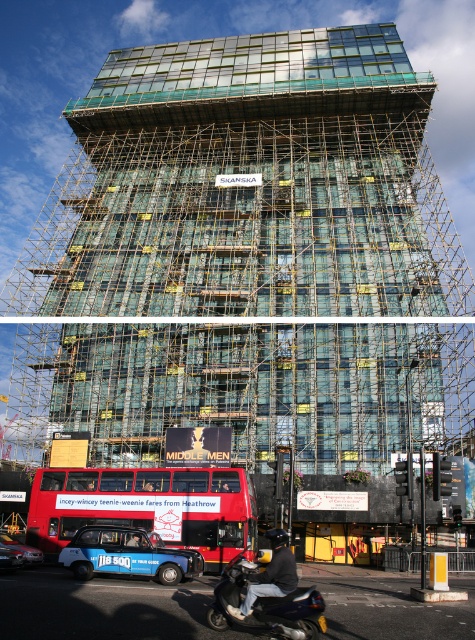
Question: Which point is farther to the camera?

Choices:
 (A) dark gray leather jacket at lower center
 (B) red matte double-decker bus at lower left

Answer: (B)

Question: Is shiny black scooter at lower center in front of dark gray leather jacket at lower center?

Choices:
 (A) yes
 (B) no

Answer: (A)

Question: Considering the relative positions of red matte double-decker bus at lower left and shiny black scooter at lower center in the image provided, where is red matte double-decker bus at lower left located with respect to shiny black scooter at lower center?

Choices:
 (A) above
 (B) below

Answer: (A)

Question: Which point appears farthest from the camera in this image?

Choices:
 (A) (282, 570)
 (B) (250, 515)

Answer: (B)

Question: Estimate the real-world distances between objects in this image. Which object is closer to the dark gray leather jacket at lower center?

Choices:
 (A) red matte double-decker bus at lower left
 (B) shiny black scooter at lower center

Answer: (B)

Question: Is the position of shiny black scooter at lower center more distant than that of dark gray leather jacket at lower center?

Choices:
 (A) no
 (B) yes

Answer: (A)